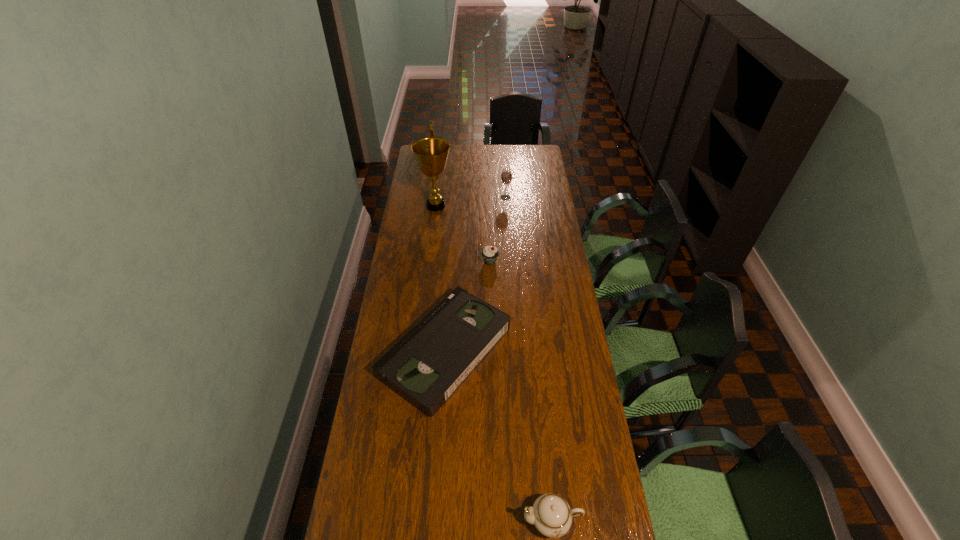
The image size is (960, 540). Identify the location of free spot between the fourth shortest object and the videotape. (475, 274).

You are a GUI agent. You are given a task and a screenshot of the screen. Output one action in this format:
    pyautogui.click(x=<x>, y=<y>)
    Task: Click on the object that is the second closest to the fourth farthest object
    The image size is (960, 540).
    Given the screenshot: What is the action you would take?
    pyautogui.click(x=552, y=516)

The image size is (960, 540). What are the coordinates of `object that stands as the second closest to the tallest object` in the screenshot? It's located at (490, 254).

The width and height of the screenshot is (960, 540). I want to click on vacant space that satisfies the following two spatial constraints: 1. on the front view with handles of the tallest object; 2. on the back side of the third nearest object, so click(429, 262).

At what (x,y) coordinates should I click in order to perform the action: click on vacant space that satisfies the following two spatial constraints: 1. on the front view with handles of the award; 2. on the left side of the cupcake. Please return your answer as a coordinate pair (x, y). This screenshot has width=960, height=540. Looking at the image, I should click on (429, 262).

The image size is (960, 540). Find the location of `free spot that satisfies the following two spatial constraints: 1. on the front view with handles of the third nearest object; 2. on the left side of the award`. free spot that satisfies the following two spatial constraints: 1. on the front view with handles of the third nearest object; 2. on the left side of the award is located at coordinates (429, 262).

The height and width of the screenshot is (540, 960). In order to click on vacant space that satisfies the following two spatial constraints: 1. on the front view with handles of the tallest object; 2. on the back side of the videotape in this screenshot , I will do `click(420, 350)`.

Locate an element on the screen. The width and height of the screenshot is (960, 540). free space that satisfies the following two spatial constraints: 1. on the front view with handles of the videotape; 2. on the right side of the award is located at coordinates (420, 350).